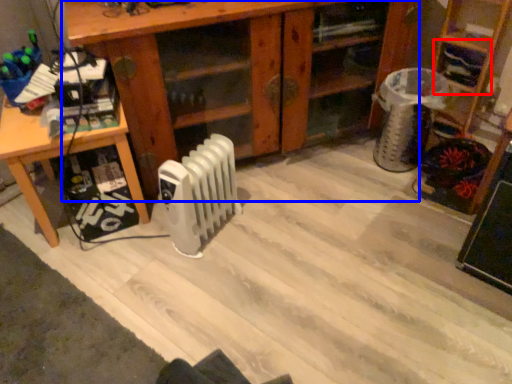
Question: Which object appears farthest to the camera in this image, shelf (highlighted by a red box) or shelf (highlighted by a blue box)?

Choices:
 (A) shelf
 (B) shelf

Answer: (A)